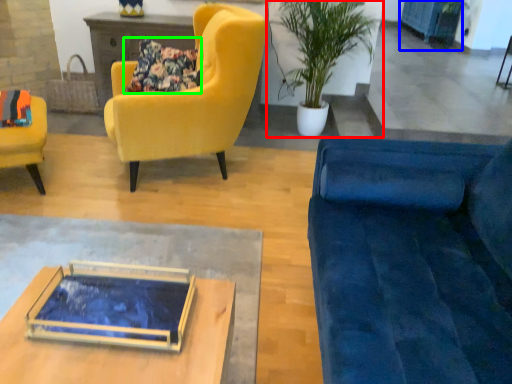
Question: Which is farther away from houseplant (highlighted by a red box)? cabinetry (highlighted by a blue box) or pillow (highlighted by a green box)?

Choices:
 (A) cabinetry
 (B) pillow

Answer: (A)